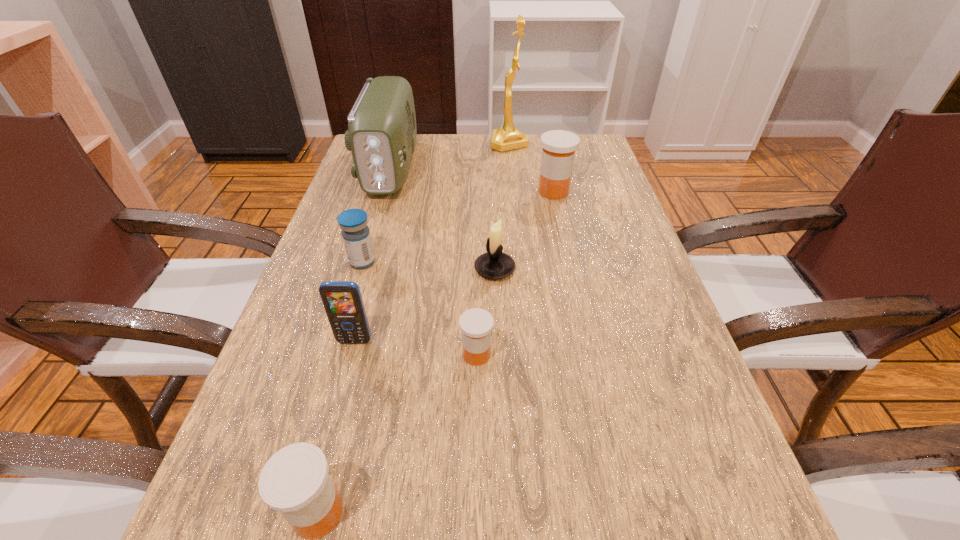
Locate an element on the screen. The height and width of the screenshot is (540, 960). free space at the right edge is located at coordinates (661, 304).

Locate an element on the screen. vacant space at the far right corner is located at coordinates (583, 147).

Where is `free space between the second nearest medicine and the radio_receiver`? free space between the second nearest medicine and the radio_receiver is located at coordinates (434, 261).

Where is `free space that is in between the radio_receiver and the third nearest medicine`? free space that is in between the radio_receiver and the third nearest medicine is located at coordinates (376, 215).

Locate an element on the screen. The image size is (960, 540). empty location between the second farthest medicine and the second tallest object is located at coordinates (376, 215).

Locate an element on the screen. empty space between the blue medicine and the tallest object is located at coordinates (436, 202).

Where is `free space between the radio_receiver and the award`? free space between the radio_receiver and the award is located at coordinates (450, 156).

Where is `free point between the white candle holder and the radio_receiver`? The height and width of the screenshot is (540, 960). free point between the white candle holder and the radio_receiver is located at coordinates (443, 219).

Where is `object that stands as the fourth closest to the candle holder`? The height and width of the screenshot is (540, 960). object that stands as the fourth closest to the candle holder is located at coordinates (342, 300).

Point out which object is positioned as the seventh nearest to the second farthest orange medicine. Please provide its 2D coordinates. Your answer should be formatted as a tuple, i.e. [(x, y)], where the tuple contains the x and y coordinates of a point satisfying the conditions above.

[(507, 137)]